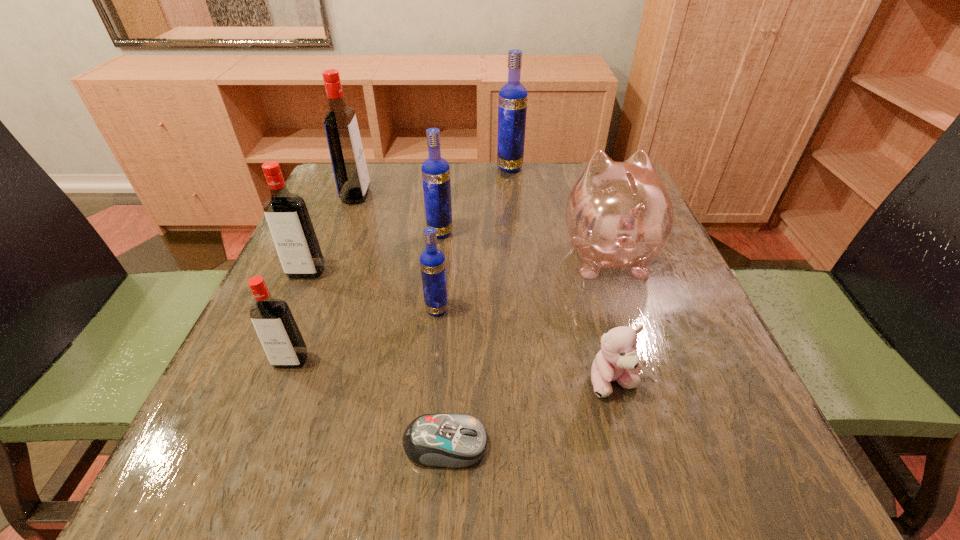
Locate an element on the screen. This screenshot has width=960, height=540. vodka that is the second closest to the rightmost blue vodka is located at coordinates (351, 175).

Locate which vodka ranks fifth in proximity to the nearest object. Please provide its 2D coordinates. Your answer should be formatted as a tuple, i.e. [(x, y)], where the tuple contains the x and y coordinates of a point satisfying the conditions above.

[(351, 175)]

This screenshot has width=960, height=540. What are the coordinates of `blue vodka that is the third nearest to the second shortest object` in the screenshot? It's located at (512, 104).

You are a GUI agent. You are given a task and a screenshot of the screen. Output one action in this format:
    pyautogui.click(x=<x>, y=<y>)
    Task: Click on the blue vodka that is the third closest to the second smallest red vodka
    
    Given the screenshot: What is the action you would take?
    pyautogui.click(x=512, y=104)

Where is `red vodka that can be found as the third closest to the piggy bank`? This screenshot has width=960, height=540. red vodka that can be found as the third closest to the piggy bank is located at coordinates (286, 214).

Select which red vodka appears as the closest to the piggy bank. Please provide its 2D coordinates. Your answer should be formatted as a tuple, i.e. [(x, y)], where the tuple contains the x and y coordinates of a point satisfying the conditions above.

[(351, 175)]

Where is `vacant space that satisfies the following two spatial constraints: 1. on the front and back of the second farthest object; 2. on the front and back of the second nearest red vodka`? vacant space that satisfies the following two spatial constraints: 1. on the front and back of the second farthest object; 2. on the front and back of the second nearest red vodka is located at coordinates (326, 272).

Find the location of a particular element. The width and height of the screenshot is (960, 540). free location that satisfies the following two spatial constraints: 1. on the front and back of the farthest red vodka; 2. on the front and back of the nearest red vodka is located at coordinates (292, 361).